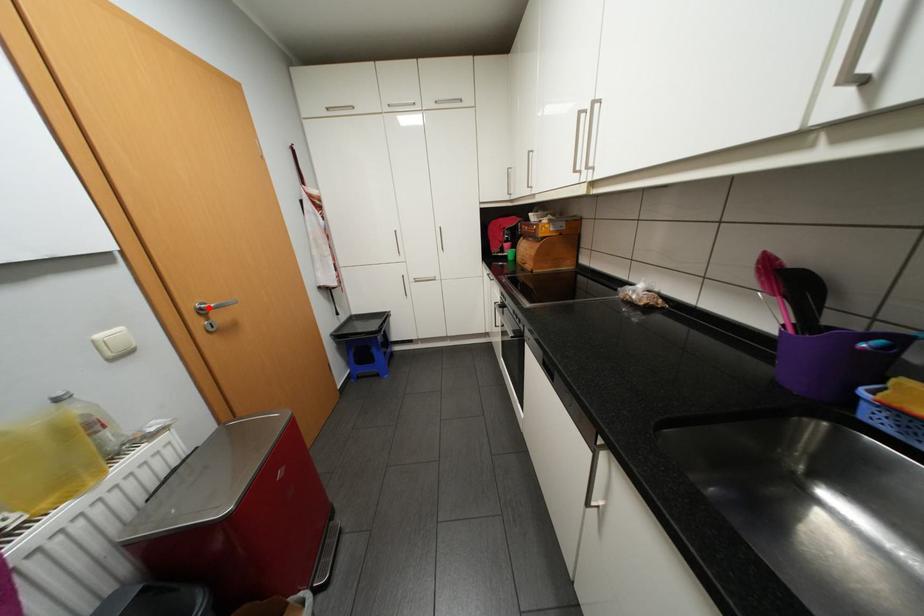
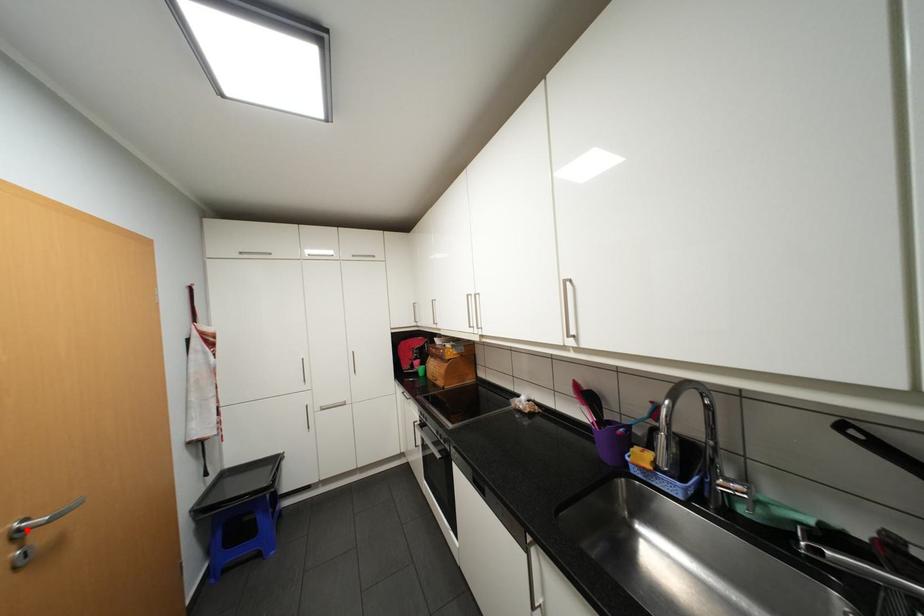
I am providing you with two images of the same scene from different viewpoints. A red point is marked on the first image and another point is marked on the second image. Do the highlighted points in image1 and image2 indicate the same real-world spot?

Yes